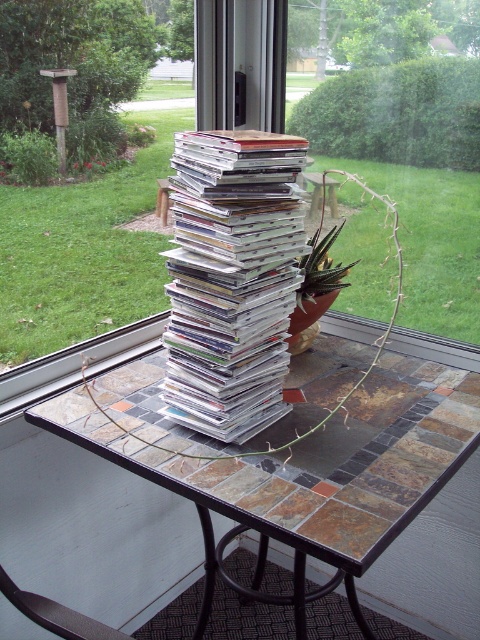
Question: Based on their relative distances, which object is nearer to the green leafy plant at center?

Choices:
 (A) green succulent at center
 (B) tile mosaic table at center
 (C) clear plastic magazines at center

Answer: (A)

Question: Which object is farther from the camera taking this photo?

Choices:
 (A) clear plastic magazines at center
 (B) tile mosaic table at center
 (C) green succulent at center

Answer: (C)

Question: From the image, what is the correct spatial relationship of tile mosaic table at center in relation to green leafy plant at center?

Choices:
 (A) above
 (B) below

Answer: (B)

Question: Is the position of tile mosaic table at center less distant than that of clear plastic magazines at center?

Choices:
 (A) yes
 (B) no

Answer: (A)

Question: Does clear plastic magazines at center have a greater width compared to green leafy plant at center?

Choices:
 (A) no
 (B) yes

Answer: (A)

Question: Which object is farther from the camera taking this photo?

Choices:
 (A) clear plastic magazines at center
 (B) green succulent at center
 (C) green leafy plant at center
 (D) tile mosaic table at center

Answer: (B)